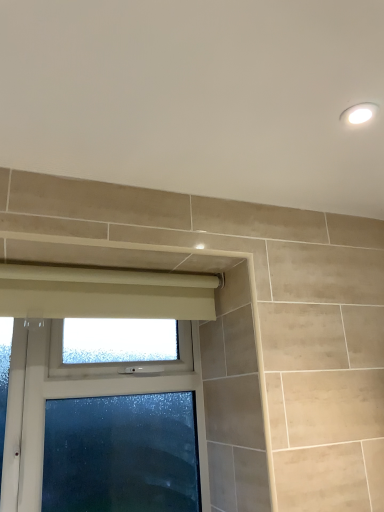
Image resolution: width=384 pixels, height=512 pixels. Describe the element at coordinates (105, 405) in the screenshot. I see `frosted glass window at lower left` at that location.

Measure the distance between white glossy light fixture at upper right and camera.

They are 93.20 centimeters apart.

You are a GUI agent. You are given a task and a screenshot of the screen. Output one action in this format:
    pyautogui.click(x=<x>, y=<y>)
    Task: Click on the frosted glass window at lower left
    
    Given the screenshot: What is the action you would take?
    105,405

Can you confirm if frosted glass window at lower left is smaller than white glossy light fixture at upper right?

Actually, frosted glass window at lower left might be larger than white glossy light fixture at upper right.

What's the angular difference between frosted glass window at lower left and white glossy light fixture at upper right's facing directions?

The angular difference between frosted glass window at lower left and white glossy light fixture at upper right is 93.3 degrees.

Is frosted glass window at lower left spatially inside white glossy light fixture at upper right, or outside of it?

frosted glass window at lower left cannot be found inside white glossy light fixture at upper right.

Is beige fabric curtain at upper center inside or outside of frosted glass window at lower left?

beige fabric curtain at upper center is not enclosed by frosted glass window at lower left.

Is beige fabric curtain at upper center in front of or behind frosted glass window at lower left in the image?

beige fabric curtain at upper center is in front of frosted glass window at lower left.

The height and width of the screenshot is (512, 384). I want to click on curtain on the right of frosted glass window at lower left, so click(x=104, y=293).

From a real-world perspective, is beige fabric curtain at upper center positioned over white glossy light fixture at upper right based on gravity?

Actually, beige fabric curtain at upper center is physically below white glossy light fixture at upper right in the real world.

Considering the positions of objects beige fabric curtain at upper center and white glossy light fixture at upper right in the image provided, who is more to the right, beige fabric curtain at upper center or white glossy light fixture at upper right?

Positioned to the right is white glossy light fixture at upper right.

Can you confirm if beige fabric curtain at upper center is taller than white glossy light fixture at upper right?

Yes, beige fabric curtain at upper center is taller than white glossy light fixture at upper right.

Consider the image. Is beige fabric curtain at upper center touching white glossy light fixture at upper right?

No, beige fabric curtain at upper center is not next to white glossy light fixture at upper right.

Looking at this image, from the image's perspective, does white glossy light fixture at upper right appear lower than frosted glass window at lower left?

No, from the image's perspective, white glossy light fixture at upper right is not beneath frosted glass window at lower left.

Which is behind, point (361, 113) or point (1, 301)?

The point (1, 301) is farther from the camera.

Considering the relative sizes of white glossy light fixture at upper right and frosted glass window at lower left in the image provided, is white glossy light fixture at upper right thinner than frosted glass window at lower left?

Indeed, white glossy light fixture at upper right has a lesser width compared to frosted glass window at lower left.

From their relative heights in the image, would you say white glossy light fixture at upper right is taller or shorter than frosted glass window at lower left?

Clearly, white glossy light fixture at upper right is shorter compared to frosted glass window at lower left.

You are a GUI agent. You are given a task and a screenshot of the screen. Output one action in this format:
    pyautogui.click(x=<x>, y=<y>)
    Task: Click on the window behind the beige fabric curtain at upper center
    Image resolution: width=384 pixels, height=512 pixels.
    Given the screenshot: What is the action you would take?
    pyautogui.click(x=105, y=405)

Is frosted glass window at lower left aimed at beige fabric curtain at upper center?

Yes, frosted glass window at lower left faces towards beige fabric curtain at upper center.

Is frosted glass window at lower left in front of or behind beige fabric curtain at upper center in the image?

frosted glass window at lower left is behind beige fabric curtain at upper center.

From the image's perspective, between frosted glass window at lower left and beige fabric curtain at upper center, who is located below?

frosted glass window at lower left, from the image's perspective.

Can you confirm if white glossy light fixture at upper right is taller than beige fabric curtain at upper center?

No, white glossy light fixture at upper right is not taller than beige fabric curtain at upper center.

Based on their sizes in the image, would you say white glossy light fixture at upper right is bigger or smaller than beige fabric curtain at upper center?

In the image, white glossy light fixture at upper right appears to be smaller than beige fabric curtain at upper center.

Considering the points (350, 114) and (134, 308), which point is behind, point (350, 114) or point (134, 308)?

The point (134, 308) is behind.

Is white glossy light fixture at upper right closer to camera compared to beige fabric curtain at upper center?

Yes, white glossy light fixture at upper right is closer to the camera.

This screenshot has height=512, width=384. Find the location of `light fixture above the frosted glass window at lower left (from a real-world perspective)`. light fixture above the frosted glass window at lower left (from a real-world perspective) is located at coordinates (358, 113).

Image resolution: width=384 pixels, height=512 pixels. Identify the location of window behind the beige fabric curtain at upper center. (105, 405).

Considering their positions, is white glossy light fixture at upper right positioned further to beige fabric curtain at upper center than frosted glass window at lower left?

The object further to beige fabric curtain at upper center is white glossy light fixture at upper right.

Estimate the real-world distances between objects in this image. Which object is closer to frosted glass window at lower left, white glossy light fixture at upper right or beige fabric curtain at upper center?

Based on the image, beige fabric curtain at upper center appears to be nearer to frosted glass window at lower left.

Considering their positions, is frosted glass window at lower left positioned further to white glossy light fixture at upper right than beige fabric curtain at upper center?

Based on the image, frosted glass window at lower left appears to be further to white glossy light fixture at upper right.

Based on the photo, considering their positions, is beige fabric curtain at upper center positioned further to white glossy light fixture at upper right than frosted glass window at lower left?

frosted glass window at lower left.

Estimate the real-world distances between objects in this image. Which object is closer to frosted glass window at lower left, beige fabric curtain at upper center or white glossy light fixture at upper right?

Among the two, beige fabric curtain at upper center is located nearer to frosted glass window at lower left.

Estimate the real-world distances between objects in this image. Which object is closer to beige fabric curtain at upper center, frosted glass window at lower left or white glossy light fixture at upper right?

The object closer to beige fabric curtain at upper center is frosted glass window at lower left.

The width and height of the screenshot is (384, 512). I want to click on curtain between white glossy light fixture at upper right and frosted glass window at lower left from top to bottom, so tap(104, 293).